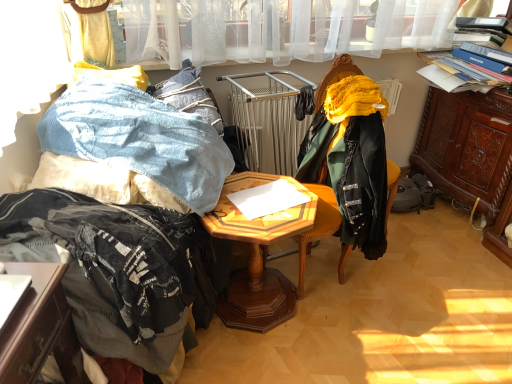
Identify the location of free location in front of velvet green chair at center. This screenshot has height=384, width=512. (331, 332).